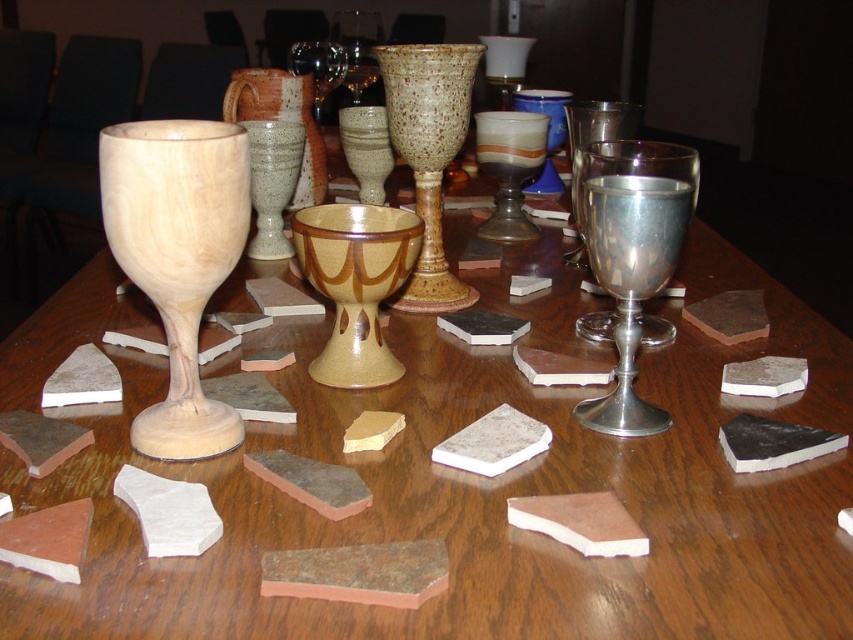
Which is more to the left, speckled ceramic goblet at center or matte ceramic goblet at center?

From the viewer's perspective, matte ceramic goblet at center appears more on the left side.

This screenshot has height=640, width=853. I want to click on speckled ceramic goblet at center, so 428,154.

The height and width of the screenshot is (640, 853). I want to click on speckled ceramic goblet at center, so click(x=428, y=154).

At what (x,y) coordinates should I click in order to perform the action: click on speckled ceramic goblet at center. Please return your answer as a coordinate pair (x, y). Image resolution: width=853 pixels, height=640 pixels. Looking at the image, I should click on (428, 154).

This screenshot has height=640, width=853. What do you see at coordinates (355, 284) in the screenshot?
I see `brown speckled ceramic goblet at center` at bounding box center [355, 284].

Can you confirm if brown speckled ceramic goblet at center is taller than speckled ceramic chalice at center?

Incorrect, brown speckled ceramic goblet at center's height is not larger of speckled ceramic chalice at center's.

Does point (326, 385) come farther from viewer compared to point (480, 124)?

That is False.

I want to click on brown speckled ceramic goblet at center, so click(x=355, y=284).

Does speckled ceramic chalice at center lie in front of matte ceramic goblet at center?

Yes, speckled ceramic chalice at center is closer to the viewer.

Is point (538, 144) more distant than point (347, 54)?

No.

The image size is (853, 640). Find the location of `speckled ceramic chalice at center`. speckled ceramic chalice at center is located at coordinates (509, 168).